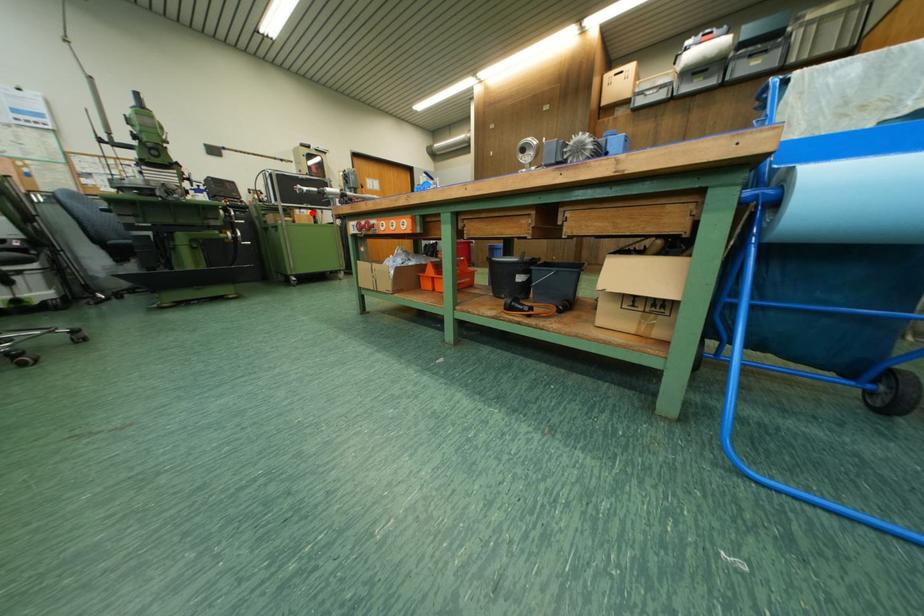
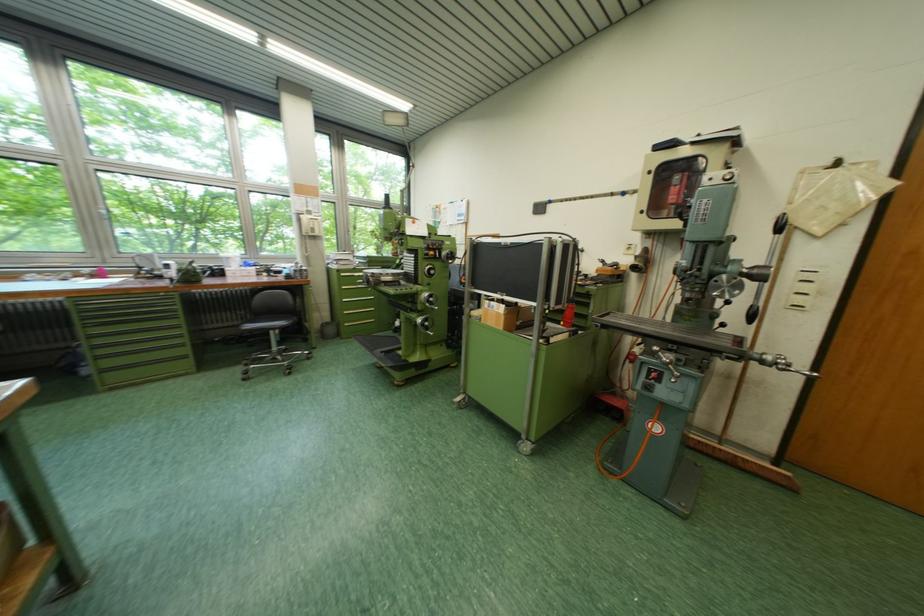
Question: I am providing you with two images of the same scene from different viewpoints. Given a red point in image1, look at the same physical point in image2. Is it:

Choices:
 (A) Closer to the viewpoint
 (B) Farther from the viewpoint

Answer: (B)